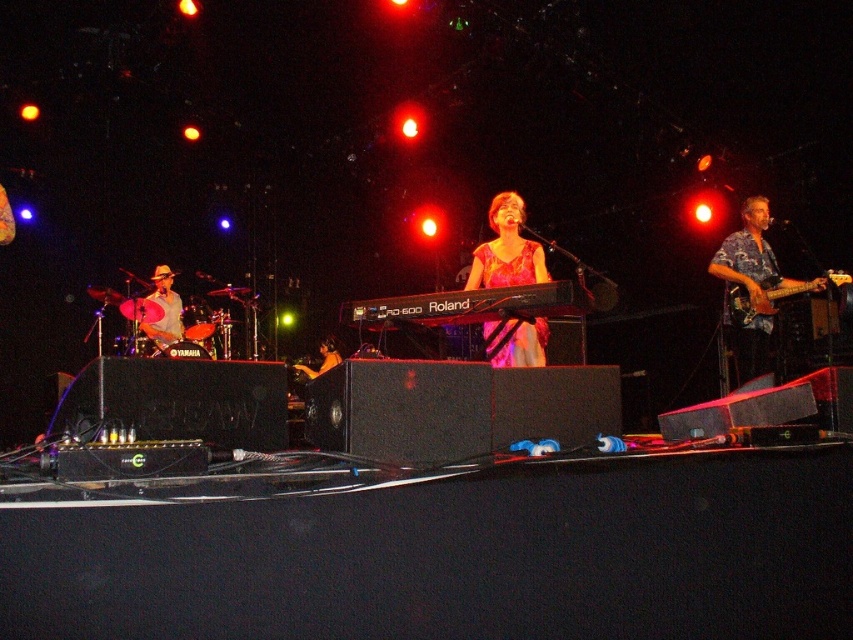
You are a photographer positioned at the back of the venue. You want to capture a clear photo of both the hawaiian print shirt at right and the wooden electric guitar at right. Since you can only focus on one subject at a time, which one should you choose to ensure the other is still somewhat in focus due to its size?

The hawaiian print shirt at right is larger in size compared to the wooden electric guitar at right. To ensure both are somewhat in focus, you should focus on the hawaiian print shirt at right because its larger size will remain more visible even if slightly out of focus, while the smaller wooden electric guitar at right will still be recognizable in the background.

You are a stagehand preparing to move equipment. You see the pink satin dress at center and the shiny black guitar at lower left. Which object is positioned more to the east on the stage?

The pink satin dress at center is to the right of the shiny black guitar at lower left, so the pink satin dress at center is positioned more to the east on the stage.

From the picture: You are a photographer positioned at the back of the stage. You want to take a photo of the shiny black guitar at lower left without the pink satin dress at center blocking it. Is this possible given their positions?

The pink satin dress at center is in front of the shiny black guitar at lower left, so taking a photo from the back of the stage would have the dress blocking the guitar. To avoid this, you would need to adjust your position or angle to capture the guitar without obstruction.